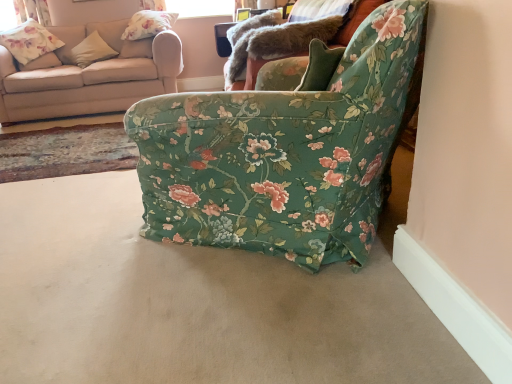
Where is `blank space to the left of floral fabric armchair at center`? The height and width of the screenshot is (384, 512). blank space to the left of floral fabric armchair at center is located at coordinates click(x=82, y=230).